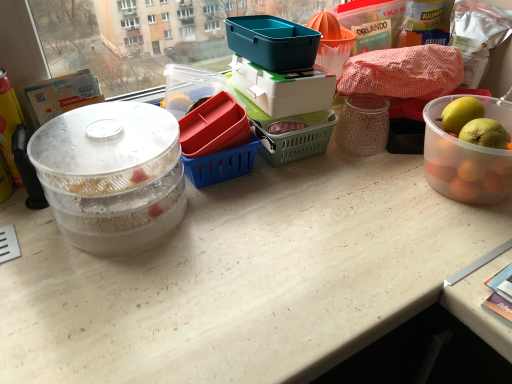
Locate an element on the screen. This screenshot has height=384, width=512. transparent plastic bowl at left is located at coordinates (111, 174).

Image resolution: width=512 pixels, height=384 pixels. Describe the element at coordinates (111, 174) in the screenshot. I see `transparent plastic bowl at left` at that location.

Identify the location of transparent plastic bowl at left. (111, 174).